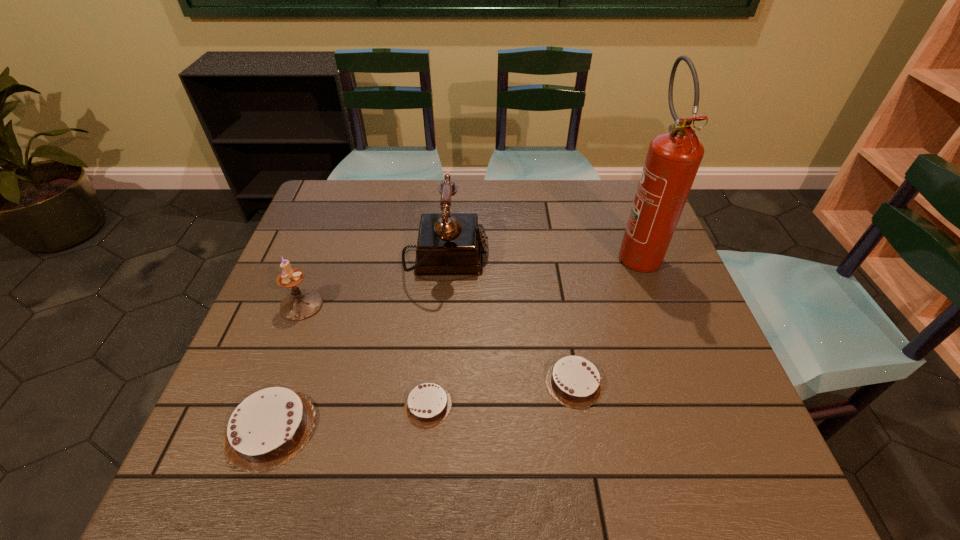
Identify the location of free space between the fire extinguisher and the shortest chocolate cake. (533, 328).

Locate an element on the screen. This screenshot has width=960, height=540. empty space that is in between the fire extinguisher and the shortest chocolate cake is located at coordinates (533, 328).

At what (x,y) coordinates should I click in order to perform the action: click on empty space that is in between the second chocolate cake from right to left and the second object from right to left. Please return your answer as a coordinate pair (x, y). Image resolution: width=960 pixels, height=540 pixels. Looking at the image, I should click on (501, 394).

Find the location of a particular element. vacant point located between the shortest object and the second shortest chocolate cake is located at coordinates (501, 394).

This screenshot has height=540, width=960. What are the coordinates of `unoccupied area between the shortest chocolate cake and the rightmost object` in the screenshot? It's located at (533, 328).

At what (x,y) coordinates should I click in order to perform the action: click on free point between the candle holder and the leftmost chocolate cake. Please return your answer as a coordinate pair (x, y). This screenshot has height=540, width=960. Looking at the image, I should click on (286, 367).

Select which object is the fifth closest to the shortest chocolate cake. Please provide its 2D coordinates. Your answer should be formatted as a tuple, i.e. [(x, y)], where the tuple contains the x and y coordinates of a point satisfying the conditions above.

[(673, 159)]

Locate an element on the screen. The height and width of the screenshot is (540, 960). the fourth closest object to the fourth shortest object is located at coordinates (573, 381).

Choose which chocolate cake is the second nearest neighbor to the second chocolate cake from right to left. Please provide its 2D coordinates. Your answer should be formatted as a tuple, i.e. [(x, y)], where the tuple contains the x and y coordinates of a point satisfying the conditions above.

[(573, 381)]

What are the coordinates of `the third closest chocolate cake relative to the fire extinguisher` in the screenshot? It's located at (269, 427).